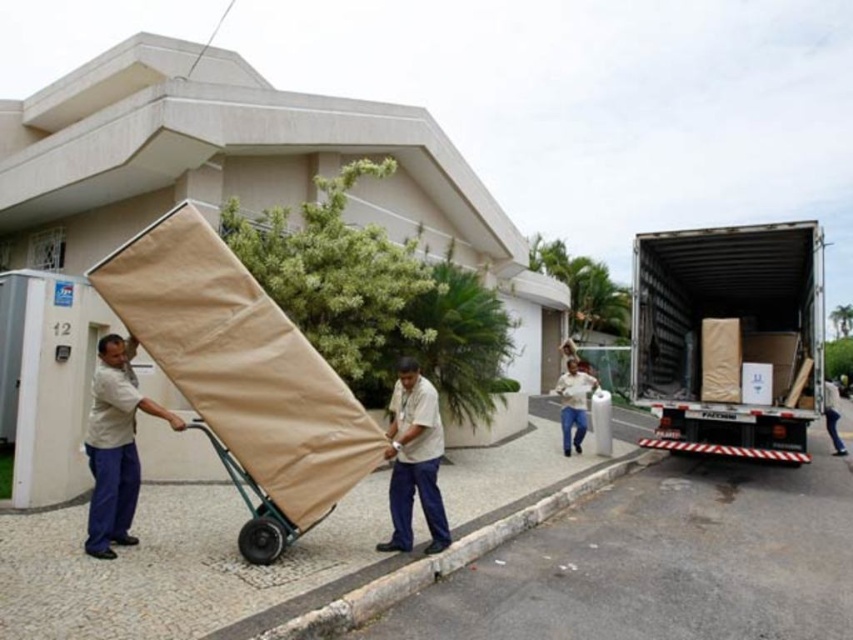
Question: In this image, where is matte cardboard truck at center located relative to beige fabric cart at center?

Choices:
 (A) right
 (B) left

Answer: (A)

Question: Can you confirm if light brown fabric at center is positioned below beige fabric cart at center?

Choices:
 (A) no
 (B) yes

Answer: (A)

Question: Which point appears closest to the camera in this image?

Choices:
 (A) (294, 538)
 (B) (575, 442)
 (C) (431, 448)
 (D) (820, 412)

Answer: (A)

Question: Estimate the real-world distances between objects in this image. Which object is closer to the light brown fabric at center?

Choices:
 (A) matte cardboard truck at center
 (B) white cotton shirt at center
 (C) light beige fabric at left

Answer: (C)

Question: Which object is the closest to the light brown fabric at center?

Choices:
 (A) matte cardboard truck at center
 (B) beige fabric cart at center

Answer: (B)

Question: Is matte cardboard truck at center to the left of light beige fabric at left from the viewer's perspective?

Choices:
 (A) yes
 (B) no

Answer: (B)